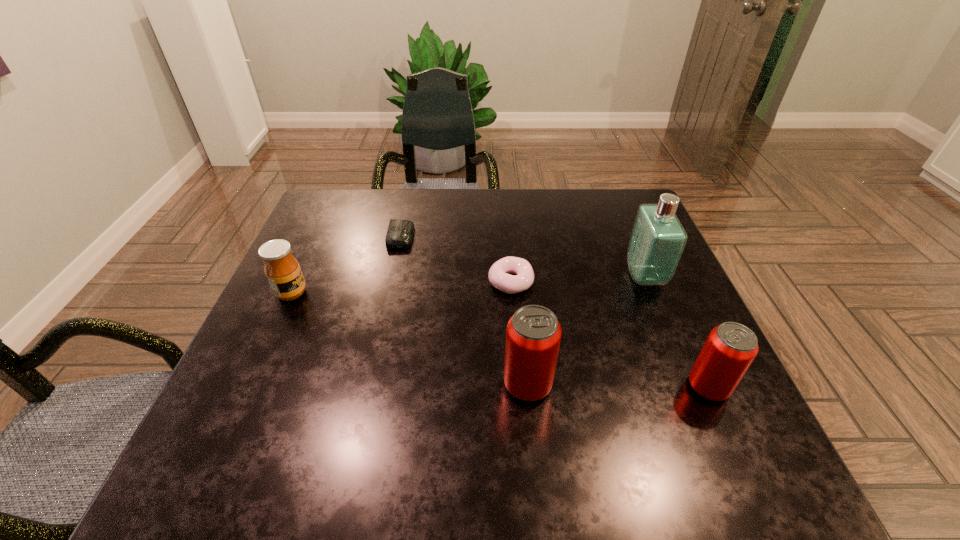
Find the location of a particular element. The image size is (960, 540). free space that satisfies the following two spatial constraints: 1. on the front label of the tallest object; 2. on the front side of the fifth shortest object is located at coordinates (689, 385).

Locate an element on the screen. This screenshot has height=540, width=960. blank space that satisfies the following two spatial constraints: 1. on the front side of the doughnut; 2. on the right side of the second tallest object is located at coordinates (518, 385).

Locate an element on the screen. free location that satisfies the following two spatial constraints: 1. on the front-facing side of the honey; 2. on the right side of the right can is located at coordinates (249, 387).